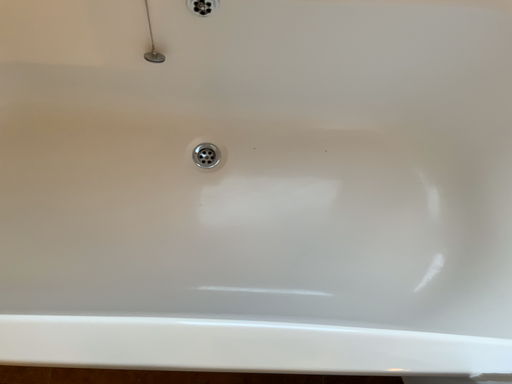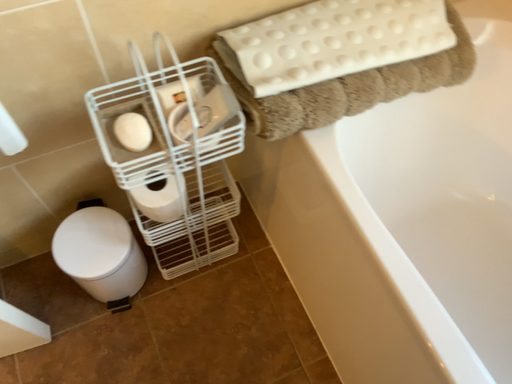
Question: How did the camera likely rotate when shooting the video?

Choices:
 (A) rotated left
 (B) rotated right

Answer: (A)